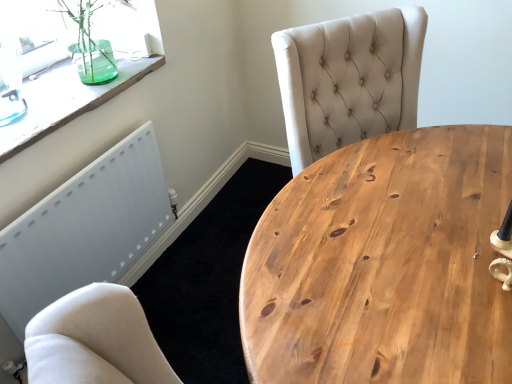
Question: From the image's perspective, relative to natural wood table at center, is transparent glass vase at upper left above or below?

Choices:
 (A) above
 (B) below

Answer: (A)

Question: From a real-world perspective, is transparent glass vase at upper left physically located above or below natural wood table at center?

Choices:
 (A) above
 (B) below

Answer: (A)

Question: Based on their relative distances, which object is farther from the white matte radiator at lower left?

Choices:
 (A) transparent glass vase at upper left
 (B) natural wood table at center
 (C) transparent glass vase at upper left

Answer: (B)

Question: Based on their relative distances, which object is nearer to the white matte radiator at lower left?

Choices:
 (A) transparent glass vase at upper left
 (B) natural wood table at center
 (C) transparent glass vase at upper left

Answer: (C)